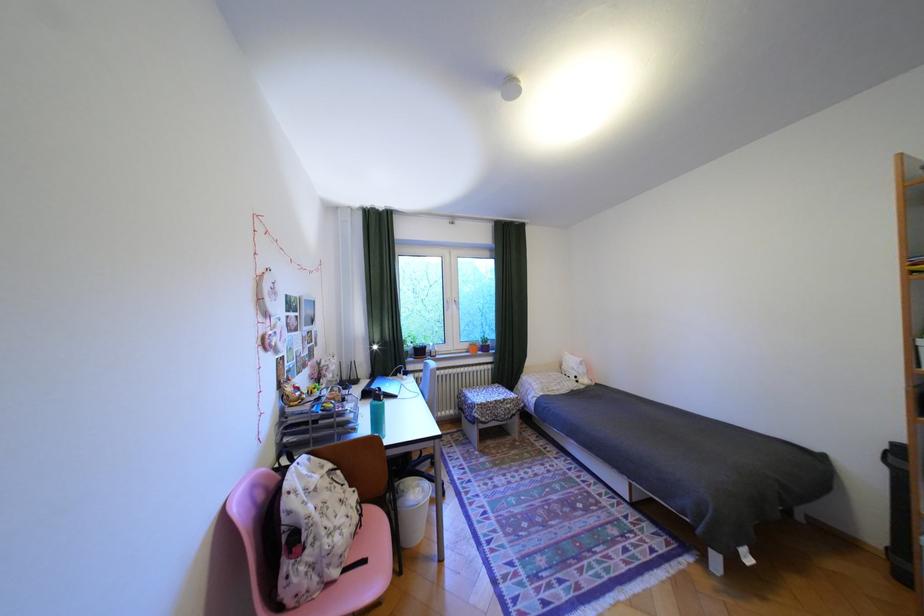
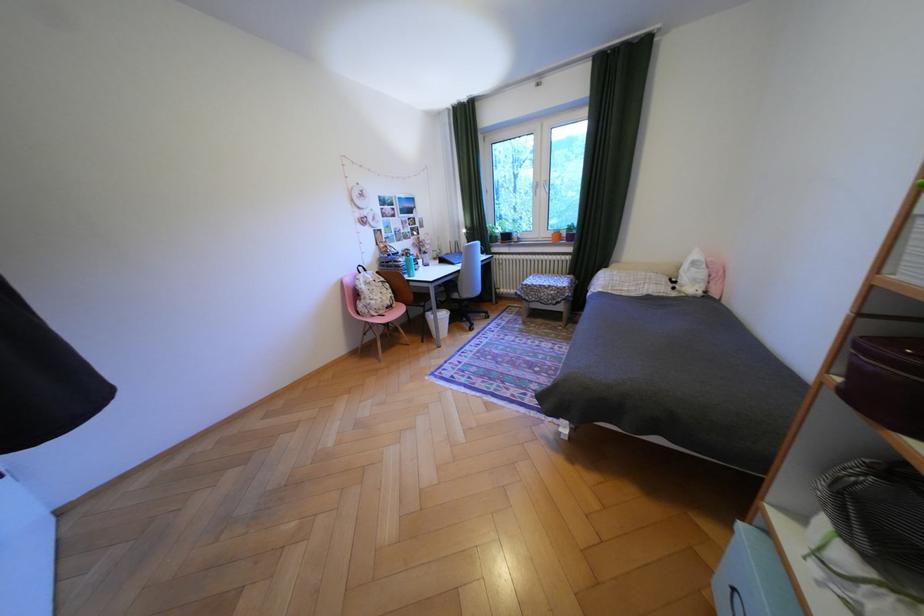
The point at (588, 378) is marked in the first image. Where is the corresponding point in the second image?

(687, 282)